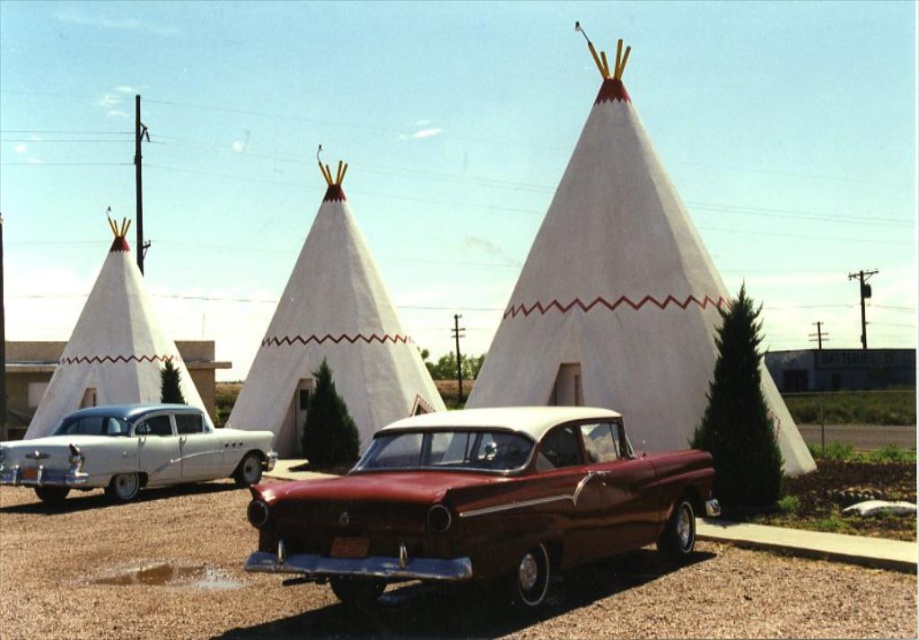
Is white canvas teepee at center bigger than white fabric tent at left?

Yes.

Does white canvas teepee at center appear on the left side of white fabric tent at left?

In fact, white canvas teepee at center is to the right of white fabric tent at left.

Where is `white canvas teepee at center`? white canvas teepee at center is located at coordinates (611, 288).

You are a GUI agent. You are given a task and a screenshot of the screen. Output one action in this format:
    pyautogui.click(x=<x>, y=<y>)
    Task: Click on the white canvas teepee at center
    
    Given the screenshot: What is the action you would take?
    pyautogui.click(x=611, y=288)

Between white canvas tent at center and white fabric tent at left, which one is positioned lower?

white fabric tent at left is lower down.

Can you confirm if white canvas tent at center is thinner than white fabric tent at left?

No, white canvas tent at center is not thinner than white fabric tent at left.

Is point (336, 182) positioned in front of point (61, 412)?

Yes, it is.

You are a GUI agent. You are given a task and a screenshot of the screen. Output one action in this format:
    pyautogui.click(x=<x>, y=<y>)
    Task: Click on the white canvas tent at center
    
    Given the screenshot: What is the action you would take?
    pyautogui.click(x=332, y=337)

Who is lower down, shiny maroon sedan at center or white canvas tent at center?

Positioned lower is shiny maroon sedan at center.

Does shiny maroon sedan at center have a lesser height compared to white canvas tent at center?

Indeed, shiny maroon sedan at center has a lesser height compared to white canvas tent at center.

Is point (668, 509) behind point (316, 212)?

No, it is in front of (316, 212).

Locate an element on the screen. The width and height of the screenshot is (919, 640). shiny maroon sedan at center is located at coordinates (480, 502).